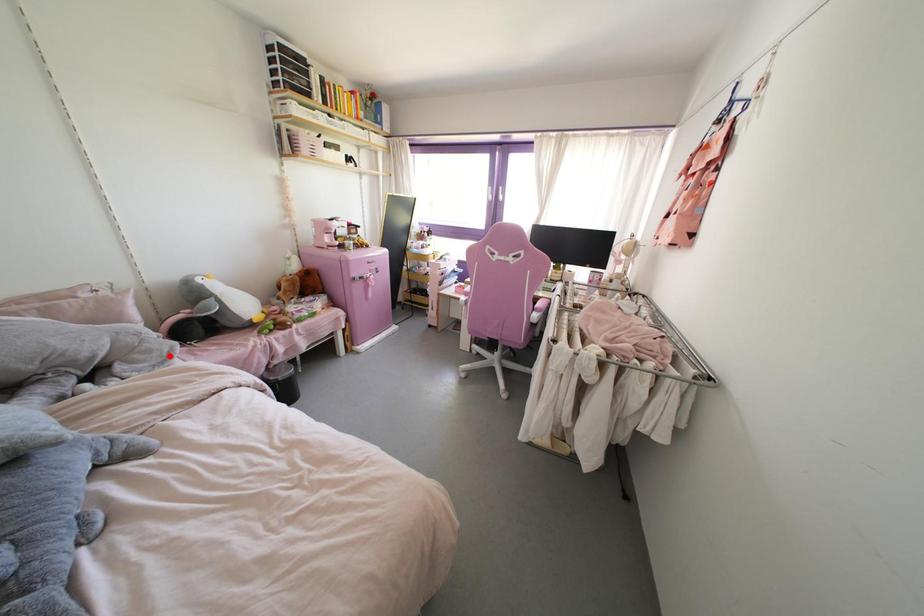
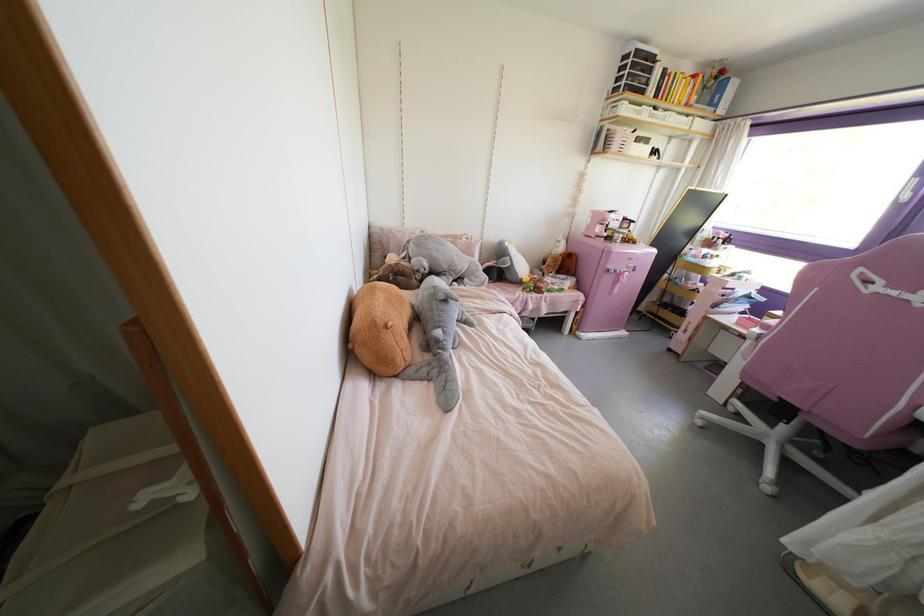
Question: I am providing you with two images of the same scene from different viewpoints. A red point is marked on the first image. Is the red point's position out of view in image 2?

Choices:
 (A) Yes
 (B) No

Answer: (B)